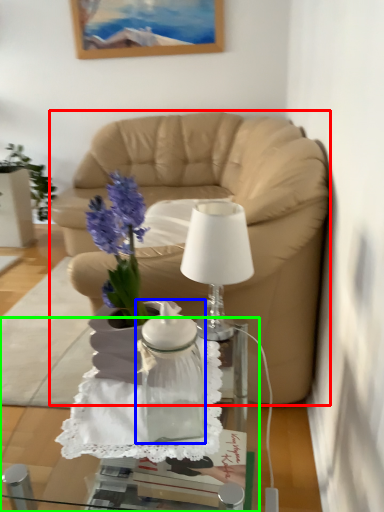
Question: Based on their relative distances, which object is nearer to studio couch (highlighted by a red box)? Choose from vase (highlighted by a blue box) and desk (highlighted by a green box).

Choices:
 (A) vase
 (B) desk

Answer: (A)